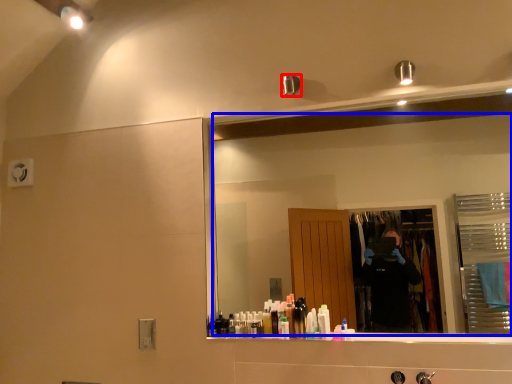
Question: Which of the following is the closest to the observer, shower (highlighted by a red box) or mirror (highlighted by a blue box)?

Choices:
 (A) shower
 (B) mirror

Answer: (B)